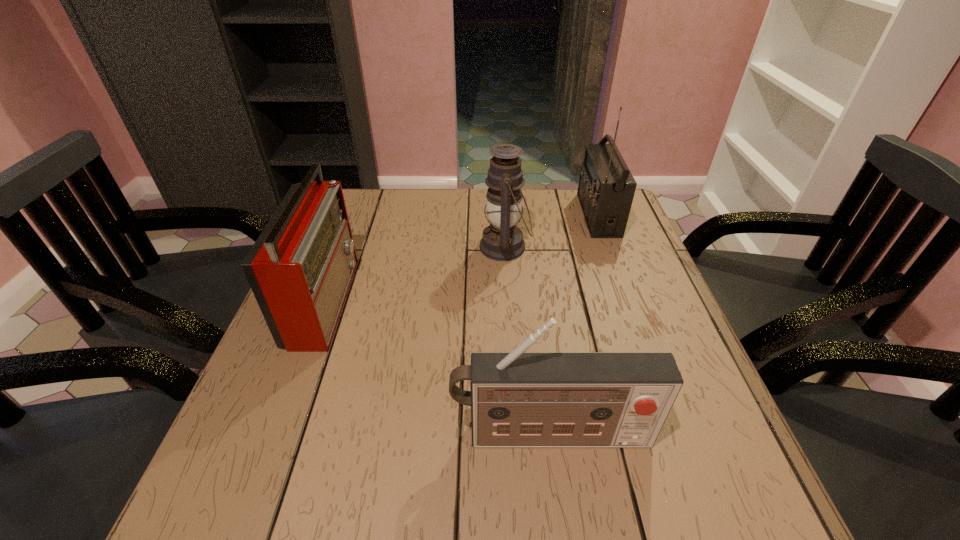
Where is `object that stands as the closest to the rightmost radio receiver`? This screenshot has width=960, height=540. object that stands as the closest to the rightmost radio receiver is located at coordinates (502, 240).

Select which object appears as the third closest to the oil lamp. Please provide its 2D coordinates. Your answer should be formatted as a tuple, i.e. [(x, y)], where the tuple contains the x and y coordinates of a point satisfying the conditions above.

[(518, 399)]

Where is `radio receiver that stands as the closest to the rightmost object`? The image size is (960, 540). radio receiver that stands as the closest to the rightmost object is located at coordinates (518, 399).

Identify which radio receiver is the second closest to the oil lamp. Please provide its 2D coordinates. Your answer should be formatted as a tuple, i.e. [(x, y)], where the tuple contains the x and y coordinates of a point satisfying the conditions above.

[(300, 269)]

This screenshot has height=540, width=960. In order to click on vacant point that satisfies the following two spatial constraints: 1. on the front panel of the tallest object; 2. on the front panel of the second radio receiver from right to left in this screenshot , I will do [679, 435].

Find the location of `vacant area that satisfies the following two spatial constraints: 1. on the front panel of the rightmost radio receiver; 2. on the front panel of the second radio receiver from right to left`. vacant area that satisfies the following two spatial constraints: 1. on the front panel of the rightmost radio receiver; 2. on the front panel of the second radio receiver from right to left is located at coordinates (679, 435).

Where is `free point that satisfies the following two spatial constraints: 1. on the front panel of the tallest object; 2. on the front panel of the nearest radio receiver`? free point that satisfies the following two spatial constraints: 1. on the front panel of the tallest object; 2. on the front panel of the nearest radio receiver is located at coordinates (679, 435).